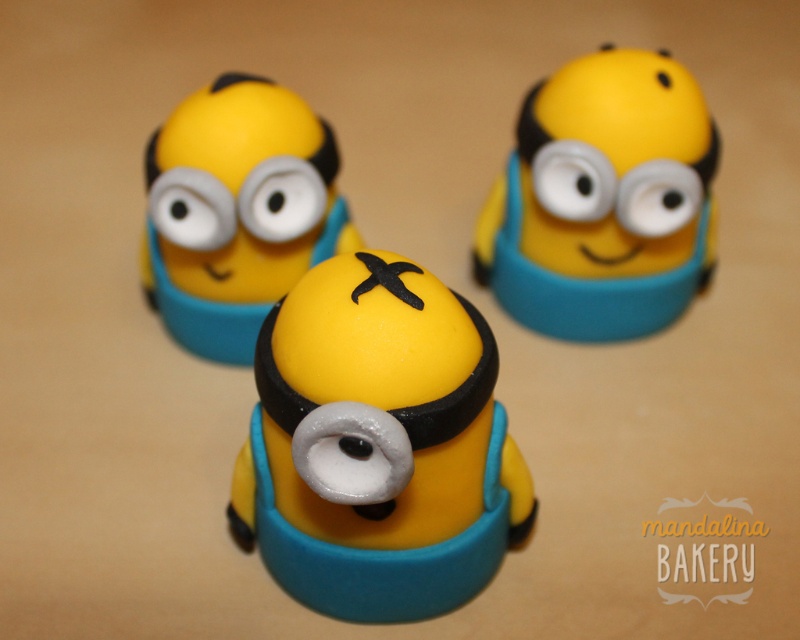
Based on the coordinates provided, which object corresponds to the point at (378,445)?

The point at (378,445) corresponds to the yellow matte minion at center.

You are planning to place a small decorative plate between the yellow matte minion at center and the yellow matte minion at upper right. Based on their sizes, will the plate fit comfortably between them?

The yellow matte minion at center is larger in width than the yellow matte minion at upper right, so the plate may fit comfortably between them depending on the plate size. However, since the exact plate dimensions are not provided, it is recommended to measure the space between the two minions first.

In the scene shown: You are a food critic observing the edible Minion figurines. Which Minion is positioned closer to you, the yellow matte minion at center or the matte yellow fondant minion at center?

The yellow matte minion at center is closer to the viewer than the matte yellow fondant minion at center.